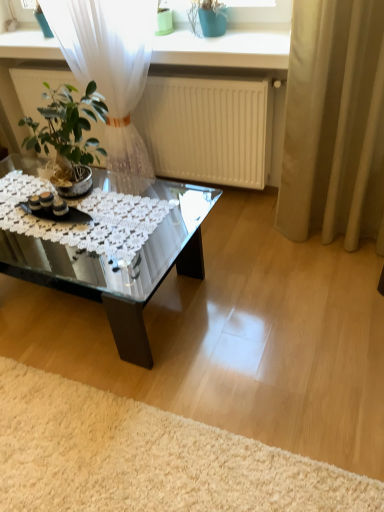
Image resolution: width=384 pixels, height=512 pixels. What are the coordinates of `transparent glass coffee table at center` in the screenshot? It's located at [123, 270].

What do you see at coordinates (208, 129) in the screenshot? The image size is (384, 512). I see `white matte radiator at upper center` at bounding box center [208, 129].

I want to click on white shaggy rug at lower left, so click(147, 458).

From a real-world perspective, is white shaggy rug at lower left below white matte radiator at upper center?

Yes, from a real-world perspective, white shaggy rug at lower left is under white matte radiator at upper center.

From the image's perspective, would you say white shaggy rug at lower left is shown under white matte radiator at upper center?

Yes, from the image's perspective, white shaggy rug at lower left is beneath white matte radiator at upper center.

Which object is positioned more to the left, white shaggy rug at lower left or white matte radiator at upper center?

white matte radiator at upper center is more to the left.

Does white shaggy rug at lower left have a lesser height compared to white matte radiator at upper center?

Yes.

Who is taller, transparent glass coffee table at center or beige fabric curtain at right?

beige fabric curtain at right.

This screenshot has width=384, height=512. I want to click on curtain above the transparent glass coffee table at center (from a real-world perspective), so click(x=334, y=123).

Is transparent glass coffee table at center inside the boundaries of beige fabric curtain at right, or outside?

transparent glass coffee table at center cannot be found inside beige fabric curtain at right.

From a real-world perspective, which object rests below the other?

transparent glass coffee table at center.

Is transparent glass coffee table at center completely or partially outside of white shaggy rug at lower left?

Indeed, transparent glass coffee table at center is completely outside white shaggy rug at lower left.

From a real-world perspective, between transparent glass coffee table at center and white shaggy rug at lower left, who is vertically lower?

white shaggy rug at lower left, from a real-world perspective.

Which is in front, transparent glass coffee table at center or white shaggy rug at lower left?

white shaggy rug at lower left.

This screenshot has height=512, width=384. I want to click on plain located on the right of white matte radiator at upper center, so click(147, 458).

How different are the orientations of white matte radiator at upper center and white shaggy rug at lower left in degrees?

The angle between the facing direction of white matte radiator at upper center and the facing direction of white shaggy rug at lower left is 0.18 degrees.

Between white matte radiator at upper center and white shaggy rug at lower left, which one has more height?

white matte radiator at upper center.

Could white shaggy rug at lower left be considered to be inside white matte radiator at upper center?

No, white shaggy rug at lower left is not inside white matte radiator at upper center.

Is beige fabric curtain at right bigger or smaller than transparent glass coffee table at center?

In the image, beige fabric curtain at right appears to be smaller than transparent glass coffee table at center.

In the scene shown: Is beige fabric curtain at right spatially inside transparent glass coffee table at center, or outside of it?

The correct answer is: outside.

Considering the relative sizes of beige fabric curtain at right and transparent glass coffee table at center in the image provided, is beige fabric curtain at right taller than transparent glass coffee table at center?

Correct, beige fabric curtain at right is much taller as transparent glass coffee table at center.

What's the angular difference between beige fabric curtain at right and transparent glass coffee table at center's facing directions?

The facing directions of beige fabric curtain at right and transparent glass coffee table at center are 6.08 degrees apart.

From a real-world perspective, is white matte radiator at upper center physically located above or below transparent glass coffee table at center?

From a real-world perspective, white matte radiator at upper center is physically above transparent glass coffee table at center.

Looking at this image, is transparent glass coffee table at center inside white matte radiator at upper center?

That's incorrect, transparent glass coffee table at center is not inside white matte radiator at upper center.

Looking at their sizes, would you say white matte radiator at upper center is wider or thinner than transparent glass coffee table at center?

Clearly, white matte radiator at upper center has less width compared to transparent glass coffee table at center.

Is beige fabric curtain at right surrounding white shaggy rug at lower left?

Actually, white shaggy rug at lower left is outside beige fabric curtain at right.

How many degrees apart are the facing directions of beige fabric curtain at right and white shaggy rug at lower left?

The facing directions of beige fabric curtain at right and white shaggy rug at lower left are 3.53 degrees apart.

From a real-world perspective, is beige fabric curtain at right physically located above or below white shaggy rug at lower left?

beige fabric curtain at right is above white shaggy rug at lower left.

Considering the positions of points (304, 136) and (128, 407), is point (304, 136) farther from camera compared to point (128, 407)?

That is True.

Identify the location of plain that appears below the white matte radiator at upper center (from the image's perspective). (147, 458).

Image resolution: width=384 pixels, height=512 pixels. I want to click on curtain behind the transparent glass coffee table at center, so click(x=334, y=123).

From the image, which object appears to be nearer to transparent glass coffee table at center, white matte radiator at upper center or beige fabric curtain at right?

Based on the image, white matte radiator at upper center appears to be nearer to transparent glass coffee table at center.

Considering their positions, is transparent glass coffee table at center positioned closer to beige fabric curtain at right than white shaggy rug at lower left?

The object closer to beige fabric curtain at right is transparent glass coffee table at center.

Which object lies further to the anchor point white matte radiator at upper center, beige fabric curtain at right or white shaggy rug at lower left?

white shaggy rug at lower left.

From the image, which object appears to be farther from beige fabric curtain at right, white shaggy rug at lower left or transparent glass coffee table at center?

white shaggy rug at lower left.

Considering their positions, is transparent glass coffee table at center positioned closer to white matte radiator at upper center than beige fabric curtain at right?

Among the two, beige fabric curtain at right is located nearer to white matte radiator at upper center.

From the image, which object appears to be farther from transparent glass coffee table at center, white matte radiator at upper center or white shaggy rug at lower left?

white matte radiator at upper center.

Estimate the real-world distances between objects in this image. Which object is further from transparent glass coffee table at center, white shaggy rug at lower left or beige fabric curtain at right?

Among the two, beige fabric curtain at right is located further to transparent glass coffee table at center.

Considering their positions, is white shaggy rug at lower left positioned further to transparent glass coffee table at center than white matte radiator at upper center?

The object further to transparent glass coffee table at center is white matte radiator at upper center.

Identify the location of curtain that lies between white matte radiator at upper center and white shaggy rug at lower left from top to bottom. (334, 123).

You are a GUI agent. You are given a task and a screenshot of the screen. Output one action in this format:
    pyautogui.click(x=<x>, y=<y>)
    Task: Click on the plain between transparent glass coffee table at center and beige fabric curtain at right from left to right
    
    Given the screenshot: What is the action you would take?
    pyautogui.click(x=147, y=458)

At what (x,y) coordinates should I click in order to perform the action: click on coffee table between white matte radiator at upper center and white shaggy rug at lower left from top to bottom. Please return your answer as a coordinate pair (x, y). Looking at the image, I should click on (123, 270).

Locate an element on the screen. The width and height of the screenshot is (384, 512). radiator between transparent glass coffee table at center and beige fabric curtain at right is located at coordinates (208, 129).